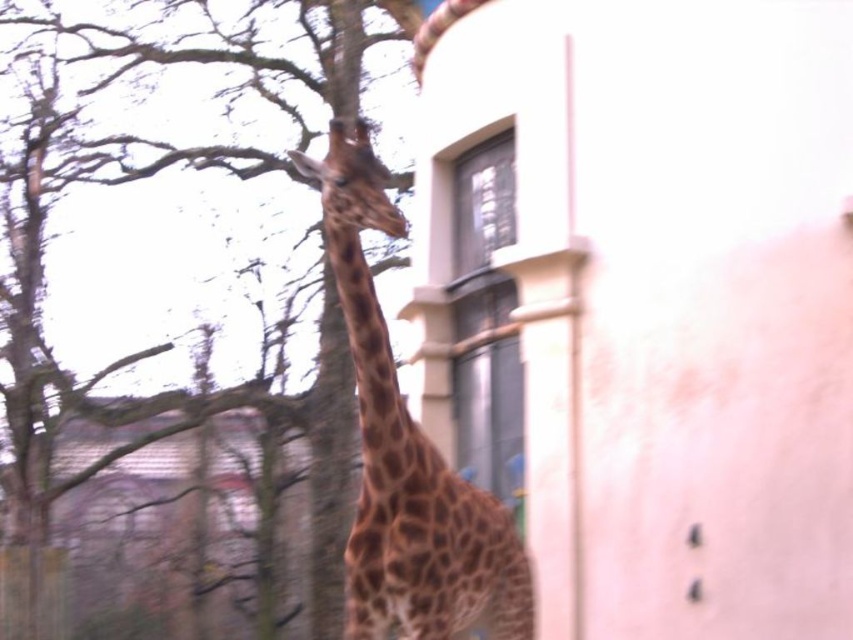
Who is lower down, brown textured tree at upper left or brown spotted giraffe at center?

brown spotted giraffe at center is below.

Which is behind, point (38, 186) or point (518, 595)?

Positioned behind is point (38, 186).

I want to click on brown textured tree at upper left, so click(x=163, y=390).